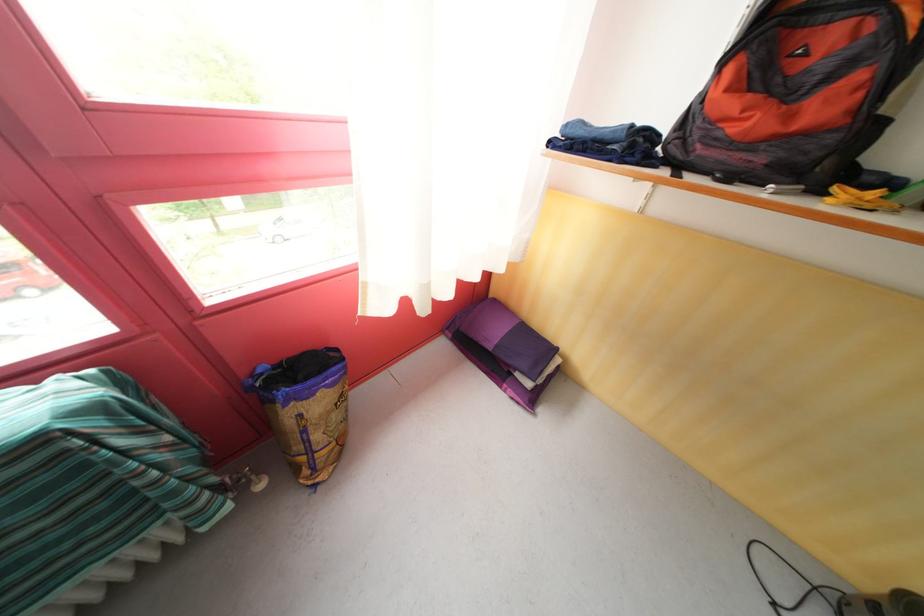
Where is `backpack top handle`? Image resolution: width=924 pixels, height=616 pixels. backpack top handle is located at coordinates (818, 6).